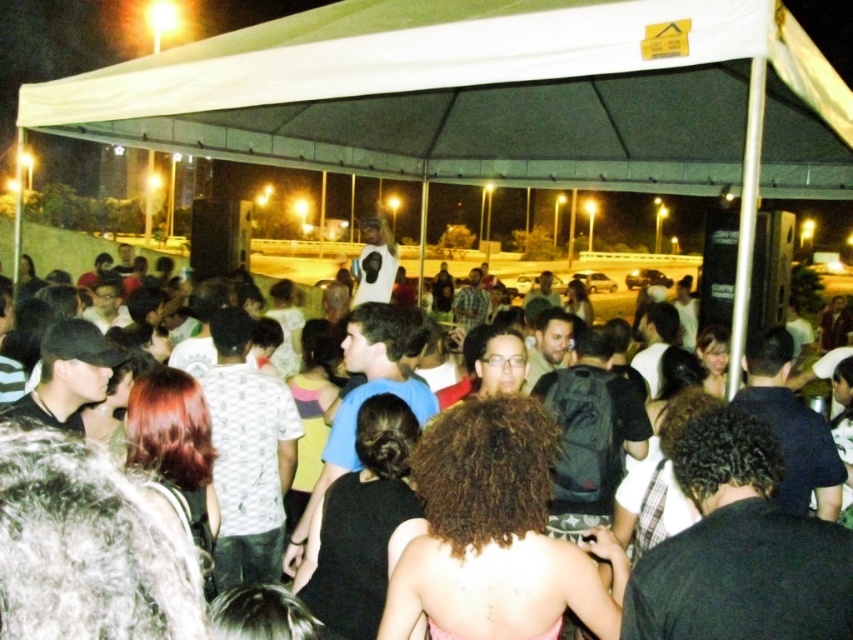
Based on the photo, does white fabric canopy at upper center appear on the left side of black fabric crowd at center?

No, white fabric canopy at upper center is not to the left of black fabric crowd at center.

Between point (280, 145) and point (115, 556), which one is positioned behind?

The point (280, 145) is more distant.

Locate an element on the screen. The height and width of the screenshot is (640, 853). white fabric canopy at upper center is located at coordinates (486, 96).